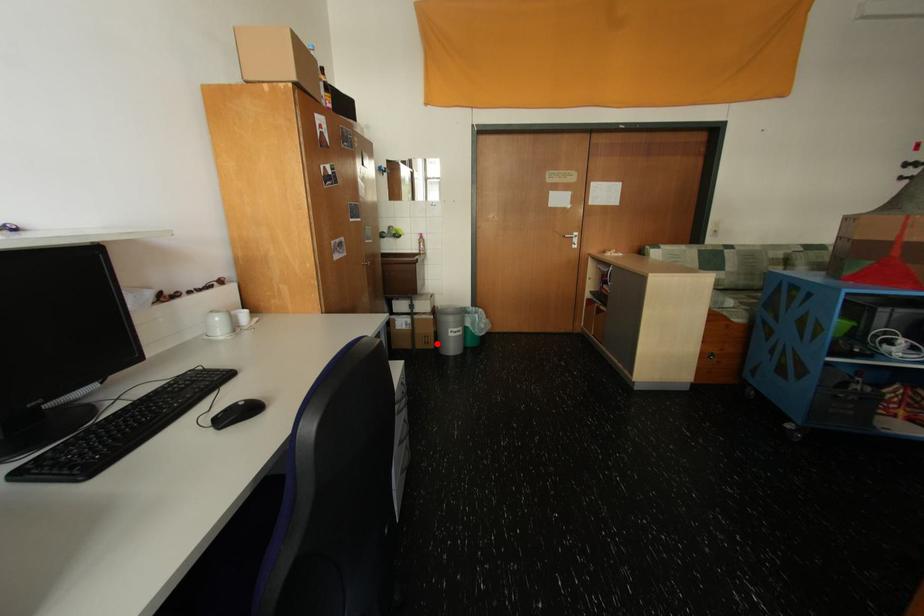
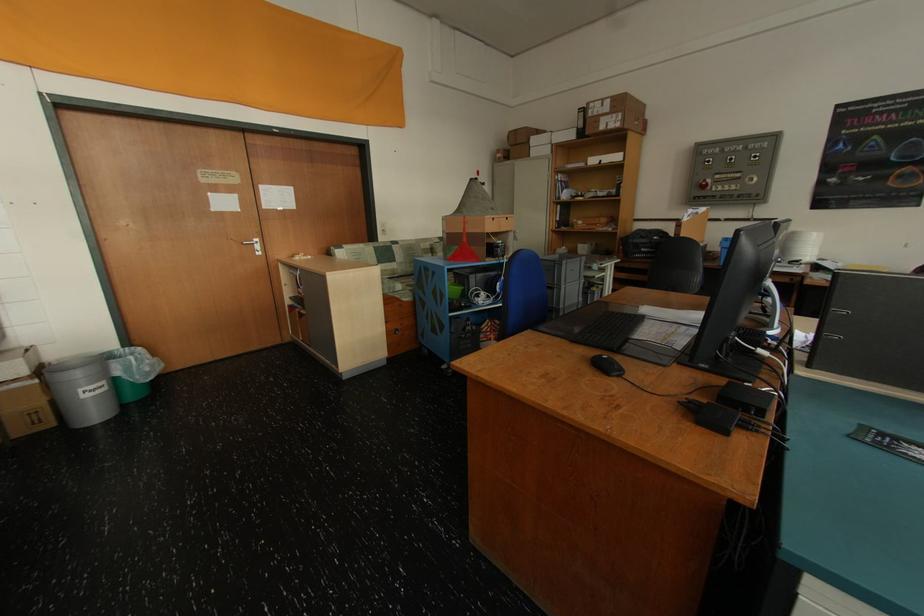
The point at the highlighted location is marked in the first image. Where is the corresponding point in the second image?

(50, 422)